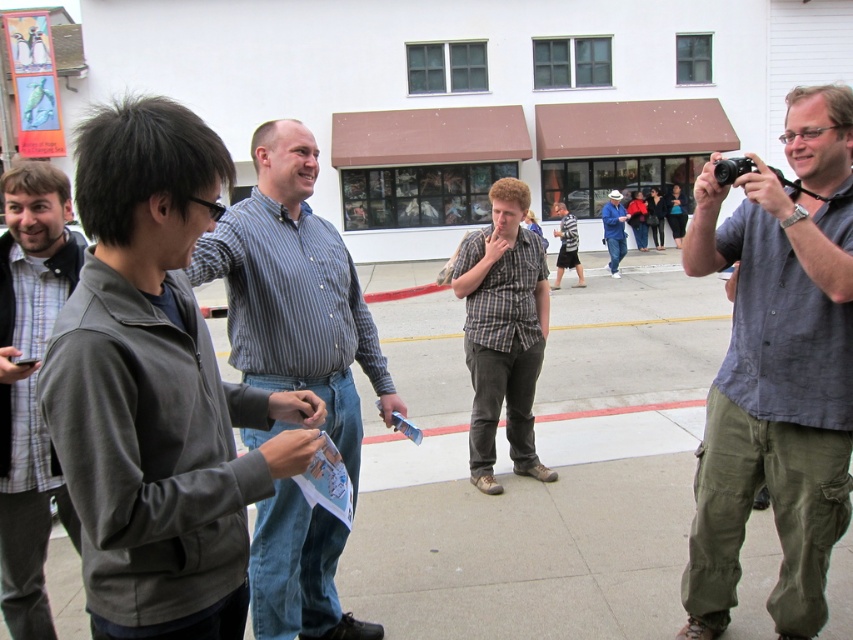
Between point (47, 456) and point (496, 228), which one is positioned in front?

Point (47, 456)

Which of these two, gray fleece jacket at left or plaid shirt at center, stands taller?

plaid shirt at center is taller.

Where is `gray fleece jacket at left`? This screenshot has height=640, width=853. gray fleece jacket at left is located at coordinates pyautogui.click(x=30, y=385).

Who is more forward, (752, 381) or (229, 276)?

Positioned in front is point (752, 381).

Does gray linen shirt at right appear on the left side of striped cotton shirt at center?

Incorrect, gray linen shirt at right is not on the left side of striped cotton shirt at center.

Does point (785, 509) come in front of point (331, 326)?

Yes, it is.

Locate an element on the screen. The image size is (853, 640). gray linen shirt at right is located at coordinates (776, 371).

Consider the image. Which of these two, gray linen shirt at right or plaid shirt at center, stands taller?

With more height is gray linen shirt at right.

Image resolution: width=853 pixels, height=640 pixels. What do you see at coordinates (776, 371) in the screenshot? I see `gray linen shirt at right` at bounding box center [776, 371].

The height and width of the screenshot is (640, 853). I want to click on gray linen shirt at right, so click(x=776, y=371).